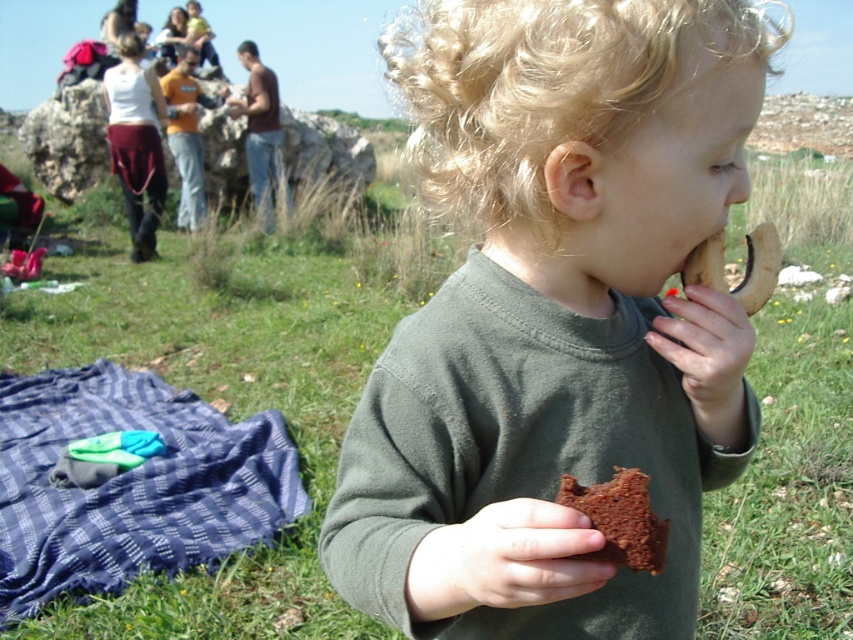
Question: Among these points, which one is nearest to the camera?

Choices:
 (A) (618, 132)
 (B) (62, 369)
 (C) (606, 529)

Answer: (C)

Question: Is dark green shirt at center further to the viewer compared to brown crumbly cookie at right?

Choices:
 (A) yes
 (B) no

Answer: (B)

Question: Estimate the real-world distances between objects in this image. Which object is closer to the dark green shirt at center?

Choices:
 (A) chocolate cake at center
 (B) blue plaid blanket at lower left
 (C) brown crumbly cookie at right

Answer: (C)

Question: Can you confirm if dark green shirt at center is bigger than chocolate cake at center?

Choices:
 (A) yes
 (B) no

Answer: (A)

Question: Is dark green shirt at center above chocolate cake at center?

Choices:
 (A) no
 (B) yes

Answer: (B)

Question: Which object is the farthest from the dark green shirt at center?

Choices:
 (A) brown crumbly cookie at right
 (B) chocolate cake at center
 (C) blue plaid blanket at lower left

Answer: (C)